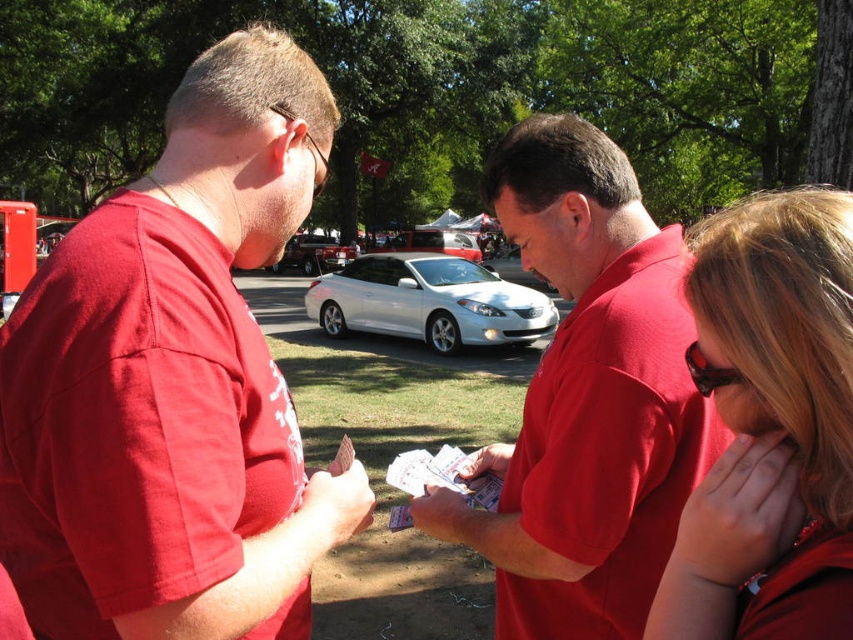
Who is more distant from viewer, (x=294, y=636) or (x=450, y=248)?

Point (x=450, y=248)

Find the location of a particular element. The width and height of the screenshot is (853, 640). matte red shirt at left is located at coordinates (173, 381).

Who is shorter, blonde hair at center or shiny silver sedan at center?

Standing shorter between the two is blonde hair at center.

Is point (775, 193) behind point (317, 262)?

No, it is in front of (317, 262).

The image size is (853, 640). Identify the location of blonde hair at center. (769, 426).

Image resolution: width=853 pixels, height=640 pixels. What do you see at coordinates (769, 426) in the screenshot? I see `blonde hair at center` at bounding box center [769, 426].

Is blonde hair at center to the left of white metallic car at center from the viewer's perspective?

Incorrect, blonde hair at center is not on the left side of white metallic car at center.

Is point (791, 368) positioned after point (410, 248)?

That is False.

Identify the location of blonde hair at center. This screenshot has height=640, width=853. (769, 426).